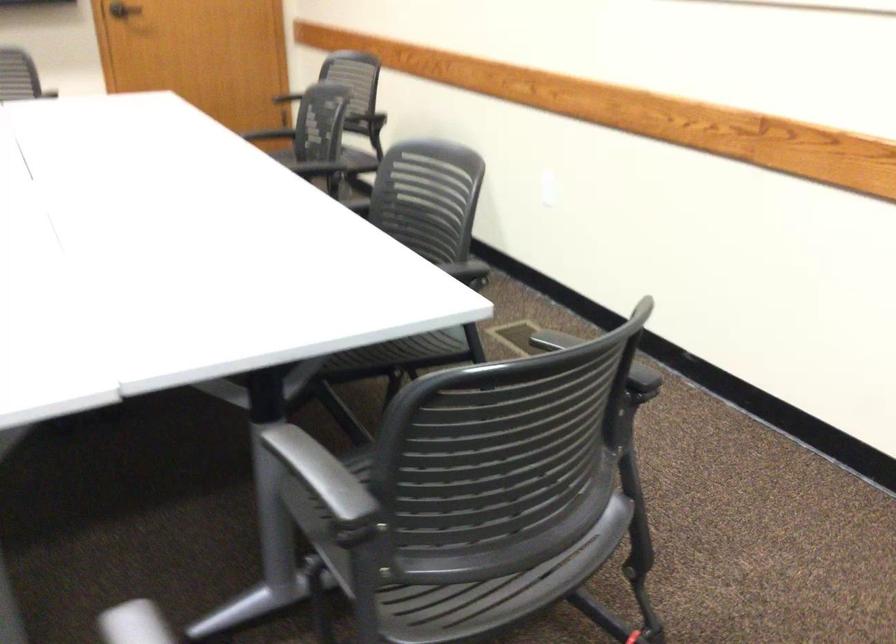
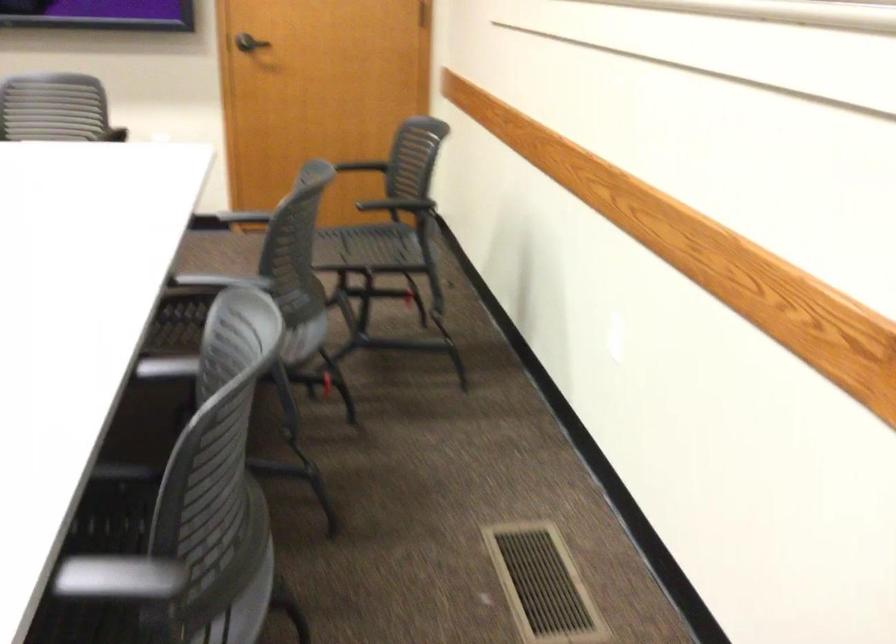
The point at (300, 167) is marked in the first image. Where is the corresponding point in the second image?

(220, 281)